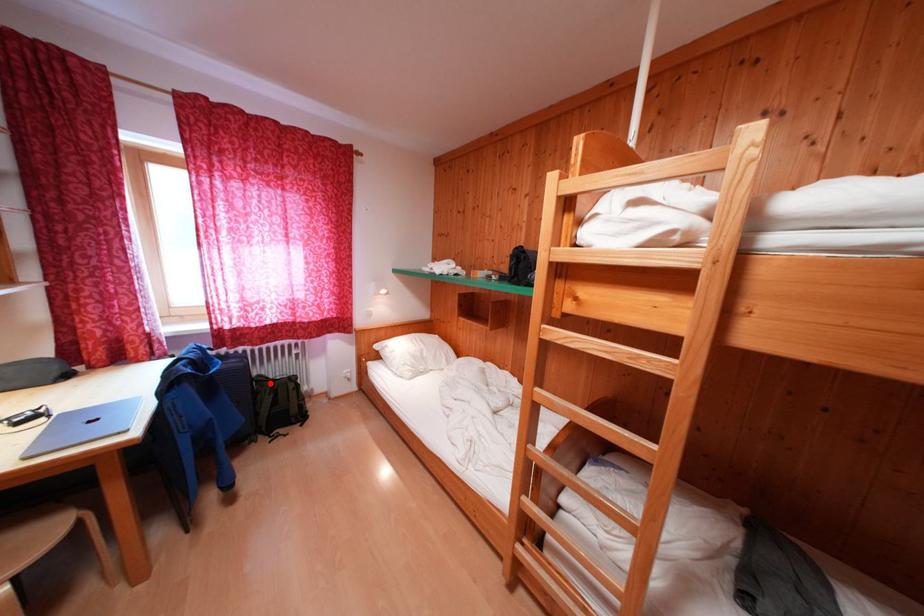
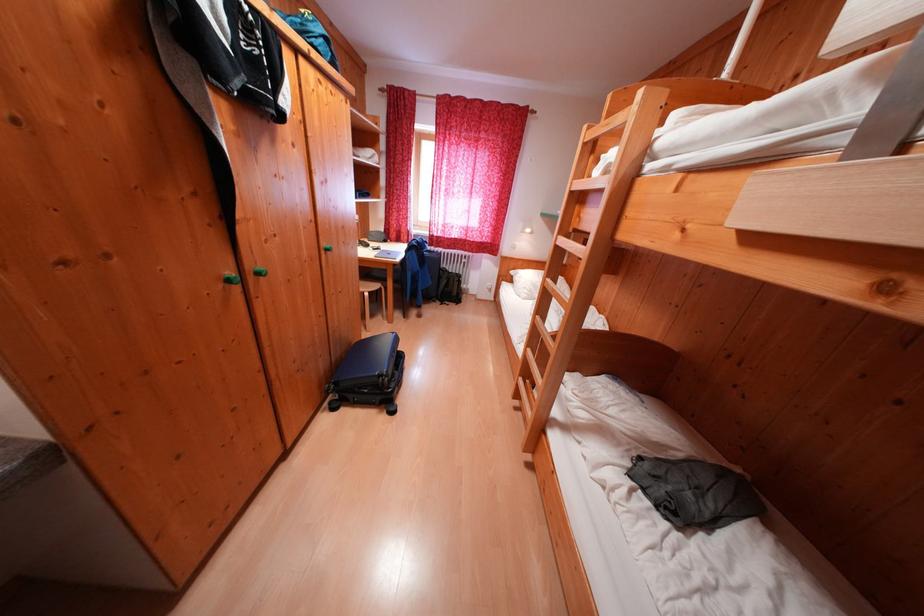
In the second image, find the point that corresponds to the highlighted location in the first image.

(454, 275)